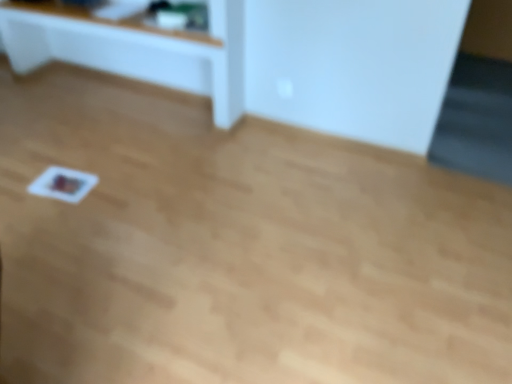
The height and width of the screenshot is (384, 512). Describe the element at coordinates (135, 49) in the screenshot. I see `white wood table at upper left` at that location.

Measure the distance between point (129, 47) and camera.

Point (129, 47) and camera are 3.02 meters apart.

You are a GUI agent. You are given a task and a screenshot of the screen. Output one action in this format:
    pyautogui.click(x=<x>, y=<y>)
    Task: Click on the white wood table at upper left
    Image resolution: width=512 pixels, height=384 pixels.
    Given the screenshot: What is the action you would take?
    pyautogui.click(x=135, y=49)

Locate an element on the screen. Image resolution: width=512 pixels, height=384 pixels. white wood table at upper left is located at coordinates (135, 49).